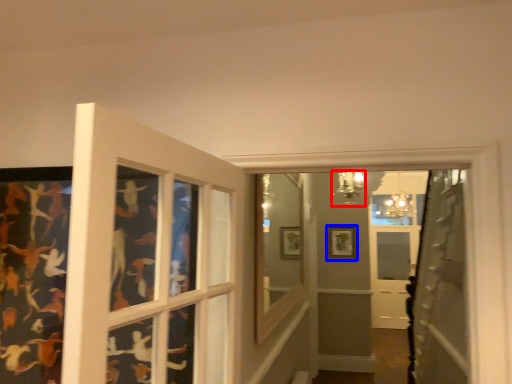
Question: Which point is further to the camera, light fixture (highlighted by a red box) or picture frame (highlighted by a blue box)?

Choices:
 (A) light fixture
 (B) picture frame

Answer: (B)